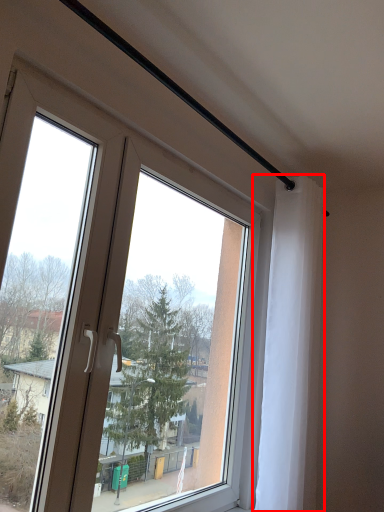
Question: From the image's perspective, where is curtain (annotated by the red box) located in relation to window in the image?

Choices:
 (A) above
 (B) below

Answer: (B)